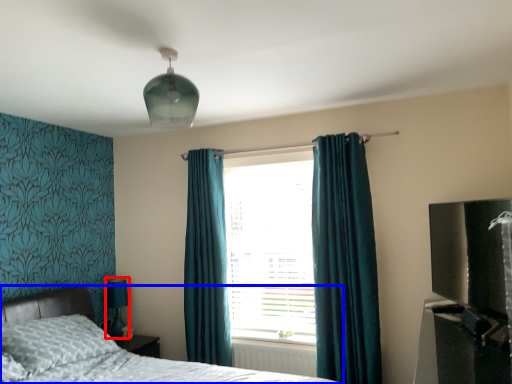
Question: Among these objects, which one is farthest to the camera, table lamp (highlighted by a red box) or bed (highlighted by a blue box)?

Choices:
 (A) table lamp
 (B) bed

Answer: (A)